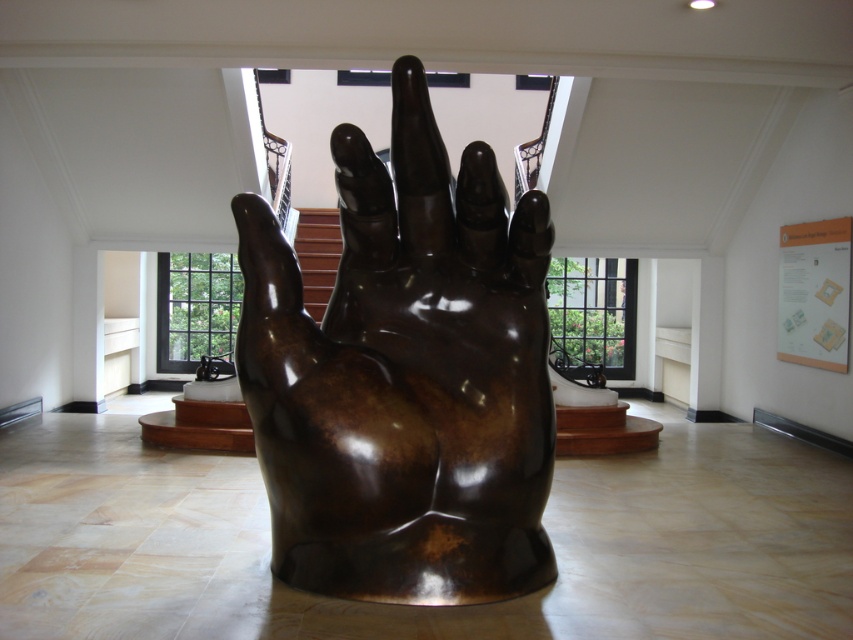
You are standing at the entrance of the gallery and want to take a photo of the shiny bronze hand at center. Which direction should you walk to get closer to it?

You should walk towards the center of the room since the shiny bronze hand at center is located at point (405, 376), which is near the central area.

You are an art curator planning to install a new sculpture. You need to ensure that the shiny bronze hand at center is visible from the brown wooden stairs at center. Based on their positions, can you confirm if the sculpture will be visible from the stairs?

The shiny bronze hand at center is below the brown wooden stairs at center, so it should be visible from the stairs as it is positioned lower and in the central area of the space.

You are an art curator planning to move the shiny bronze hand at center closer to the brown wooden stairs at center. Currently, the distance between them is 5.63 meters. If you want to reduce the distance by half, how far apart will they be?

If the distance between the shiny bronze hand at center and the brown wooden stairs at center is currently 5.63 meters, reducing it by half would result in a distance of 2.815 meters between them.